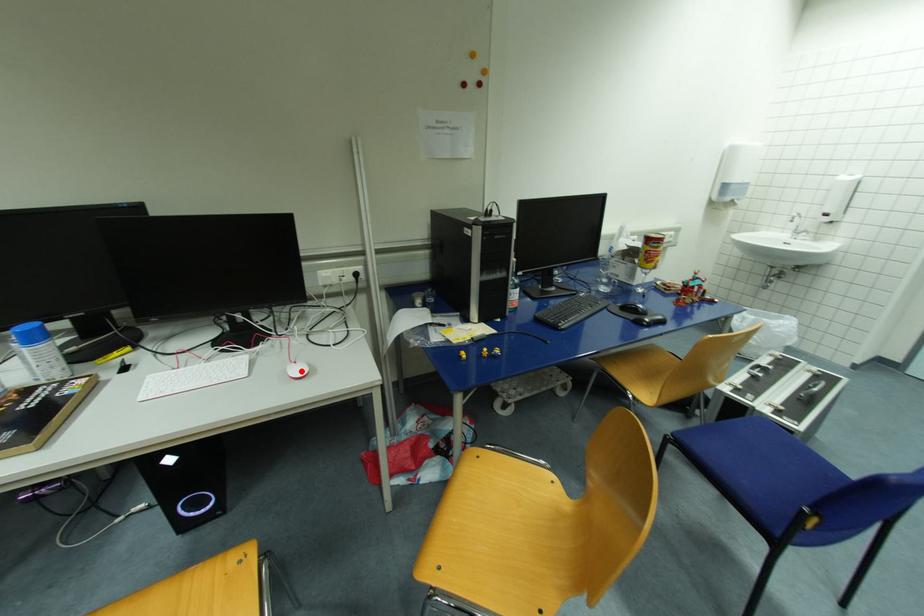
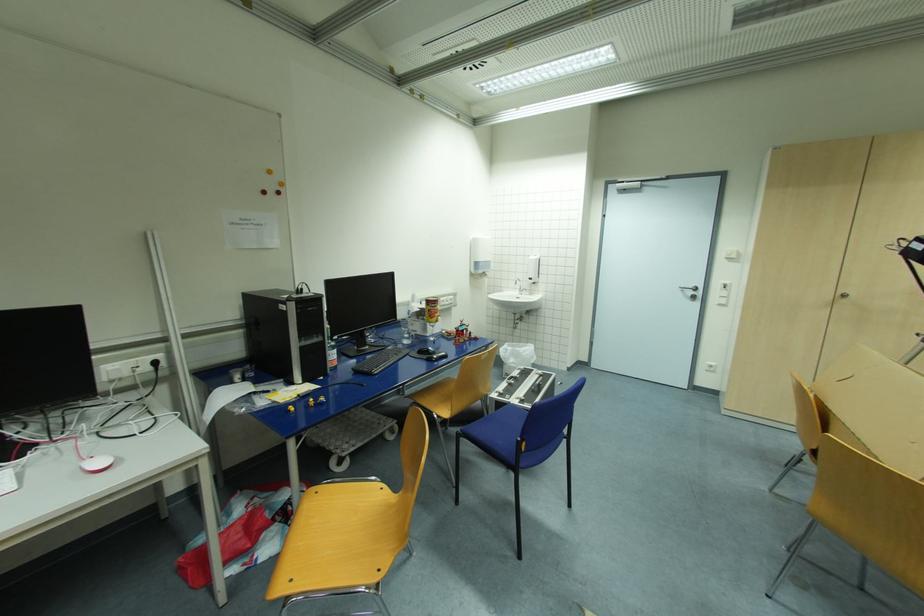
Locate, in the second image, the point that corresponds to the highlighted location in the first image.

(102, 464)